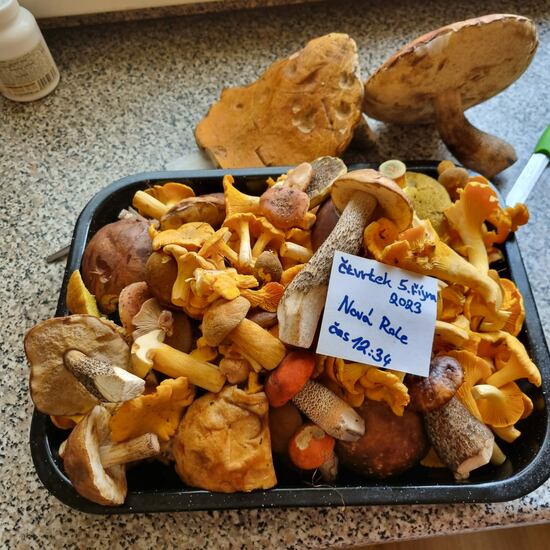
You are a GUI agent. You are given a task and a screenshot of the screen. Output one action in this format:
    pyautogui.click(x=<x>, y=<y>)
    Task: Click on the plastic plate
    
    Given the screenshot: What is the action you would take?
    pyautogui.click(x=397, y=496)